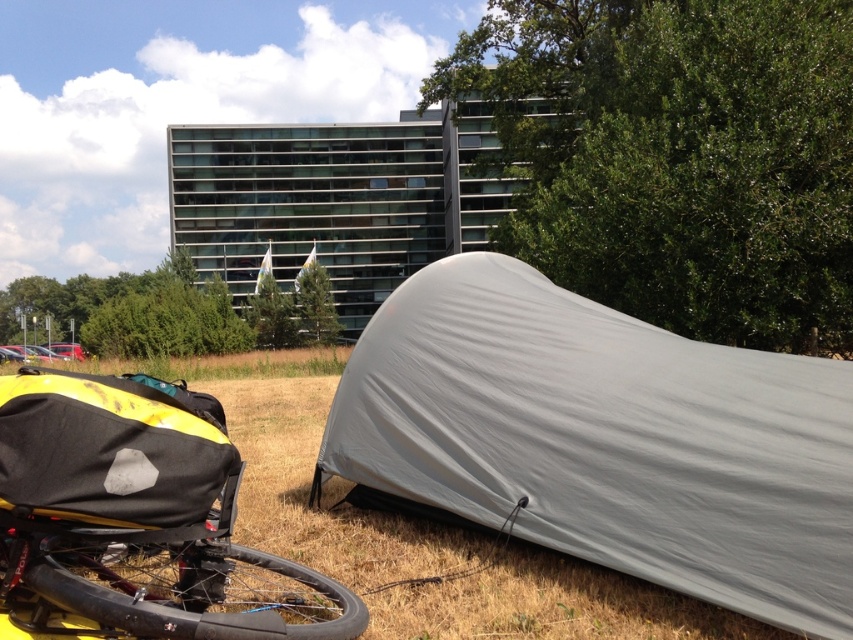
Which of these two, yellow matte bicycle at lower left or black rubber tire at lower left, stands shorter?

Standing shorter between the two is black rubber tire at lower left.

Find the location of a particular element. The height and width of the screenshot is (640, 853). yellow matte bicycle at lower left is located at coordinates [136, 518].

Is point (193, 532) in front of point (260, 616)?

That is False.

Locate an element on the screen. The height and width of the screenshot is (640, 853). yellow matte bicycle at lower left is located at coordinates (136, 518).

The width and height of the screenshot is (853, 640). What do you see at coordinates (308, 472) in the screenshot?
I see `green grass at lower center` at bounding box center [308, 472].

Based on the photo, is green grass at lower center positioned before black rubber tire at lower left?

No, green grass at lower center is behind black rubber tire at lower left.

Locate an element on the screen. The width and height of the screenshot is (853, 640). green grass at lower center is located at coordinates (308, 472).

Between point (461, 493) and point (316, 369), which one is positioned behind?

The point (316, 369) is behind.

This screenshot has height=640, width=853. I want to click on gray fabric tent at lower right, so click(x=606, y=438).